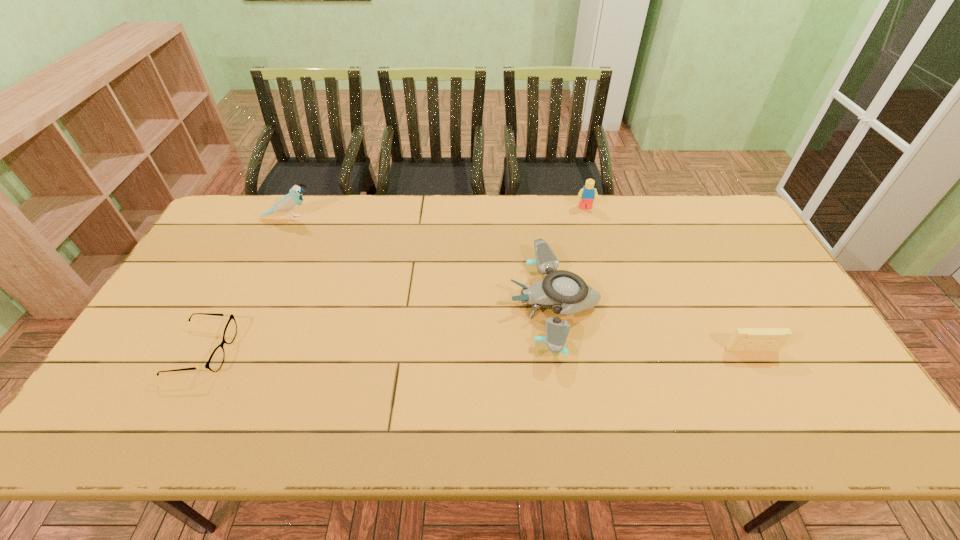
Where is `free space between the shortest object and the drone`? The image size is (960, 540). free space between the shortest object and the drone is located at coordinates (378, 328).

The width and height of the screenshot is (960, 540). In order to click on free spot between the shortest object and the tallest object in this screenshot , I will do `click(246, 285)`.

Where is `free space between the shortest object and the farthest object`? free space between the shortest object and the farthest object is located at coordinates (395, 280).

At what (x,y) coordinates should I click in order to perform the action: click on vacant point located between the bird and the drone. Please return your answer as a coordinate pair (x, y). This screenshot has height=540, width=960. Looking at the image, I should click on (421, 261).

Identify which object is the fourth closest to the bird. Please provide its 2D coordinates. Your answer should be formatted as a tuple, i.e. [(x, y)], where the tuple contains the x and y coordinates of a point satisfying the conditions above.

[(743, 339)]

Choose which object is the nearest neighbor to the drone. Please provide its 2D coordinates. Your answer should be formatted as a tuple, i.e. [(x, y)], where the tuple contains the x and y coordinates of a point satisfying the conditions above.

[(587, 194)]

This screenshot has width=960, height=540. What are the coordinates of `vacant space that satisfies the following two spatial constraints: 1. on the front-facing side of the farthest object; 2. on the front-facing side of the drone` in the screenshot? It's located at (612, 304).

This screenshot has width=960, height=540. Identify the location of vacant region that satisfies the following two spatial constraints: 1. on the front-facing side of the farthest object; 2. on the front-facing side of the drone. (612, 304).

The width and height of the screenshot is (960, 540). In order to click on vacant space that satisfies the following two spatial constraints: 1. at the front of the videotape with spools; 2. on the front-facing side of the shortest object in this screenshot , I will do `click(753, 352)`.

This screenshot has height=540, width=960. I want to click on free space that satisfies the following two spatial constraints: 1. on the front-facing side of the farthest object; 2. on the front-facing side of the drone, so click(x=612, y=304).